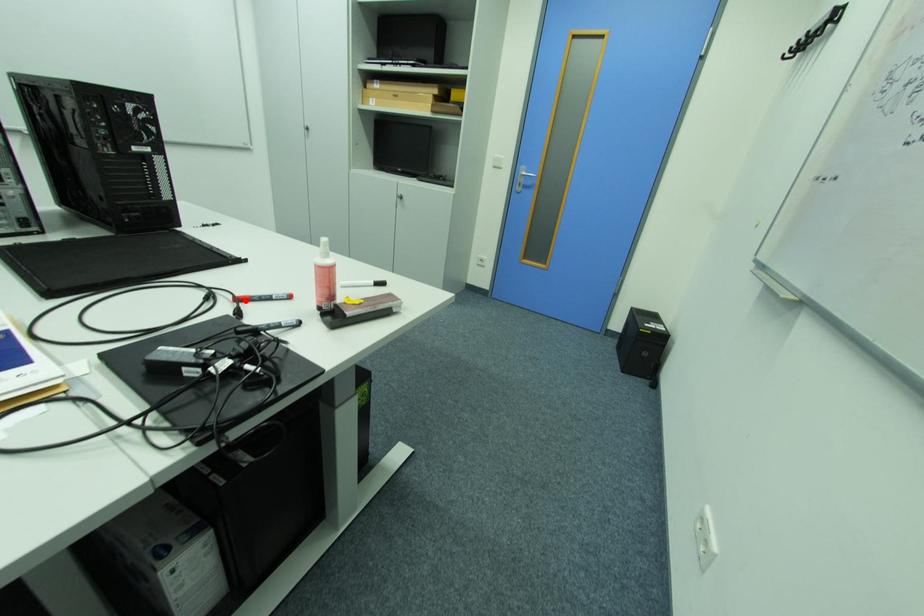
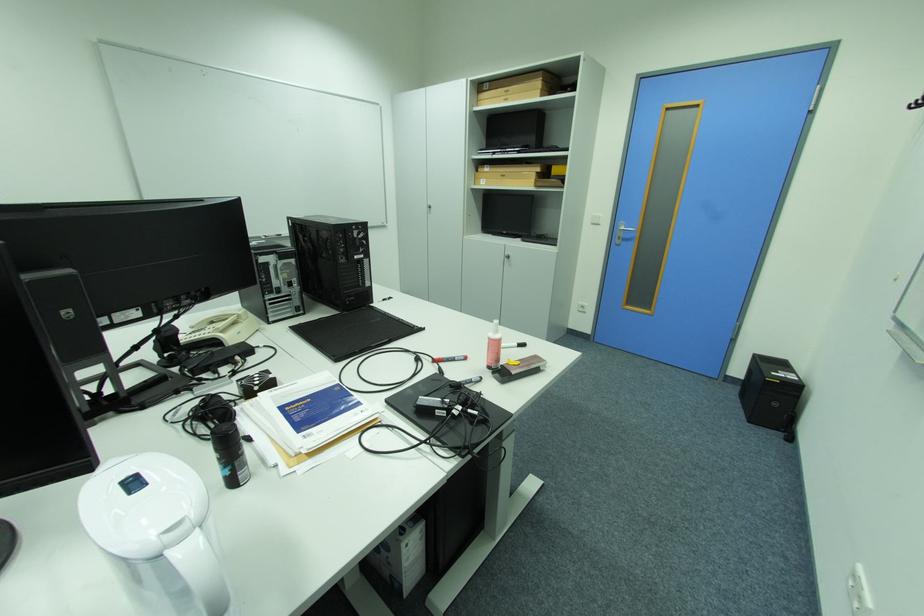
Find the pixel in the second image that matches the highlighted location in the first image.

(443, 362)